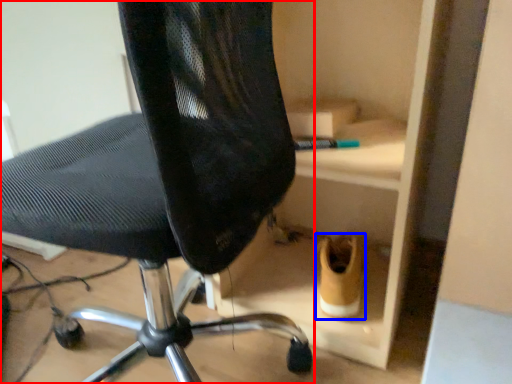
Question: Which object appears farthest to the camera in this image, chair (highlighted by a red box) or footwear (highlighted by a blue box)?

Choices:
 (A) chair
 (B) footwear

Answer: (B)